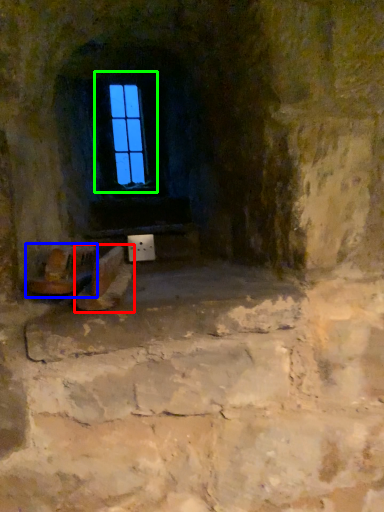
Question: Which object is positioned farthest from footwear (highlighted by a red box)? Select from chair (highlighted by a blue box) and window (highlighted by a green box).

Choices:
 (A) chair
 (B) window

Answer: (B)